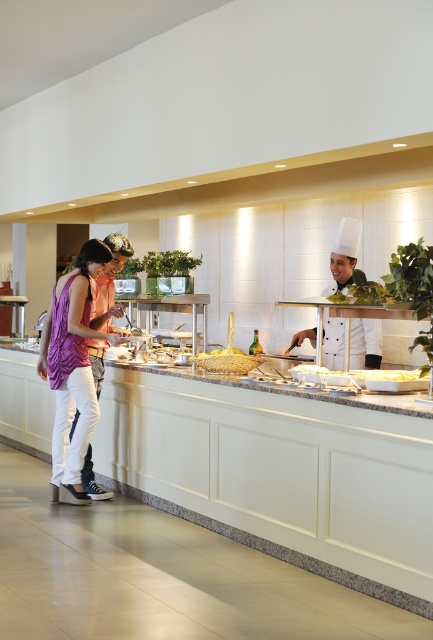
How distant is purple fabric dress at left from white chef hat at center?

They are 2.34 meters apart.

Does purple fabric dress at left have a lesser height compared to white chef hat at center?

Incorrect, purple fabric dress at left's height does not fall short of white chef hat at center's.

Image resolution: width=433 pixels, height=640 pixels. Find the location of `purple fabric dress at left`. purple fabric dress at left is located at coordinates (74, 364).

The height and width of the screenshot is (640, 433). Find the location of `purple fabric dress at left`. purple fabric dress at left is located at coordinates (74, 364).

Does point (349, 579) come closer to viewer compared to point (257, 358)?

Yes, it is in front of point (257, 358).

Who is taller, white marble counter at center or golden textured bread at center?

With more height is white marble counter at center.

Does point (398, 417) lie in front of point (229, 355)?

That is True.

Where is `white marble counter at center`? Image resolution: width=433 pixels, height=640 pixels. white marble counter at center is located at coordinates (278, 474).

Is point (272, 525) positioned behind point (401, 372)?

That is False.

Who is shorter, white marble counter at center or yellow matte pasta at center?

Standing shorter between the two is yellow matte pasta at center.

Based on the photo, measure the distance between point (x=197, y=499) and camera.

A distance of 19.00 feet exists between point (x=197, y=499) and camera.

Identify the location of white marble counter at center. The image size is (433, 640). (278, 474).